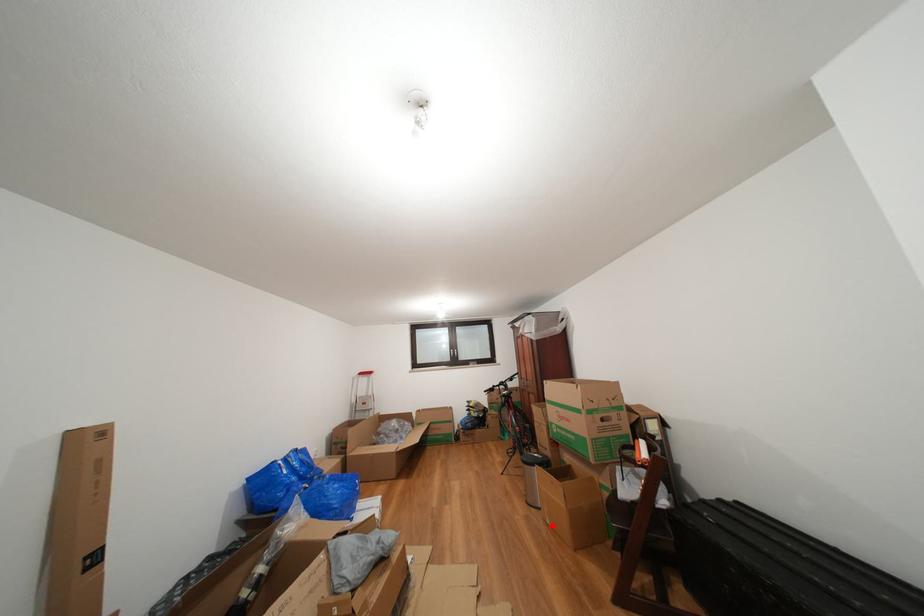
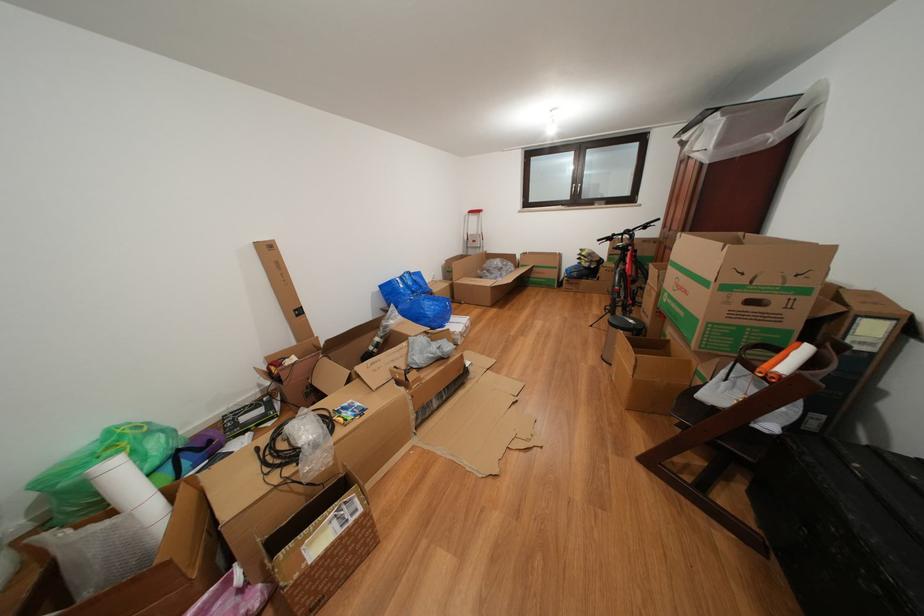
Question: I am providing you with two images of the same scene from different viewpoints. Image1 has a red point marked. In image2, the corresponding 3D location appears at what relative position? Reply with the corresponding letter.

Choices:
 (A) Closer
 (B) Farther

Answer: (A)